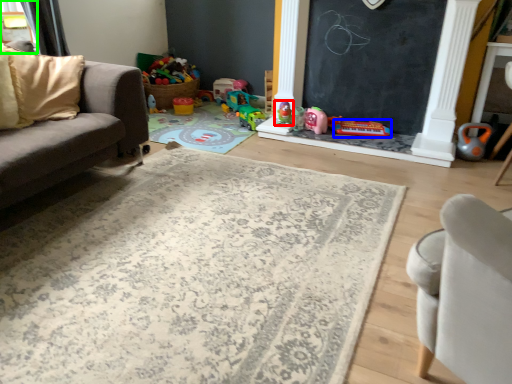
Question: Estimate the real-world distances between objects in this image. Which object is closer to toy (highlighted by a red box), toy (highlighted by a blue box) or window (highlighted by a green box)?

Choices:
 (A) toy
 (B) window

Answer: (A)